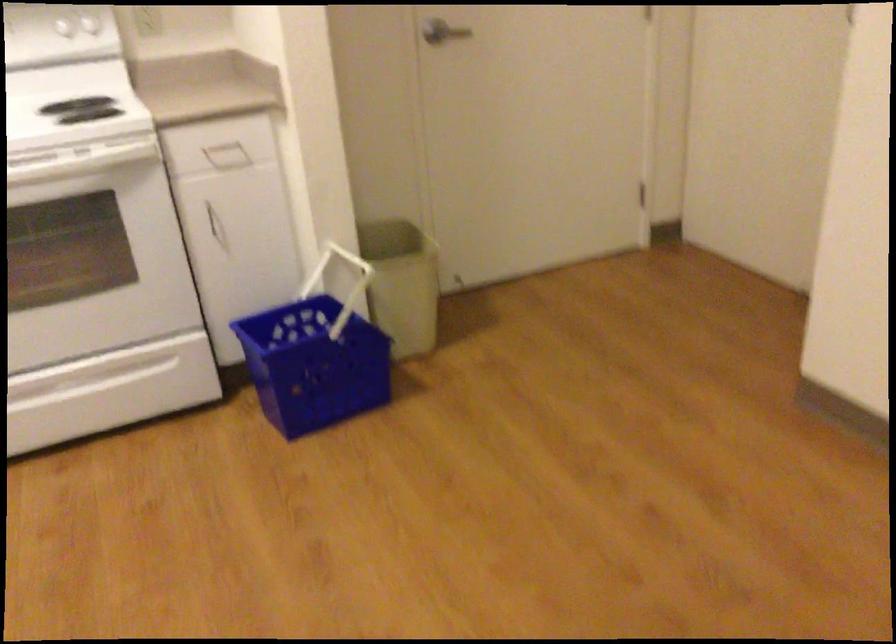
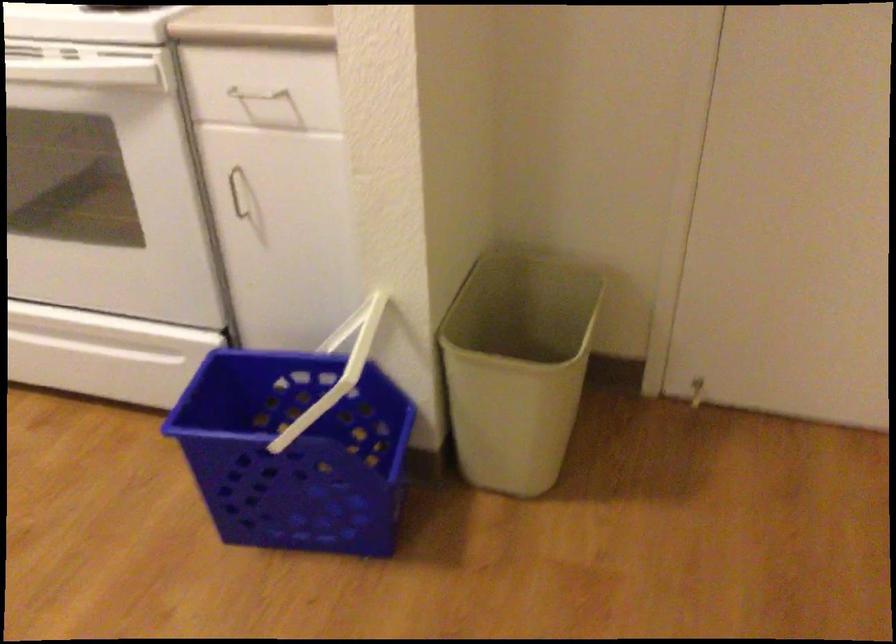
The point at (101,242) is marked in the first image. Where is the corresponding point in the second image?

(104, 185)